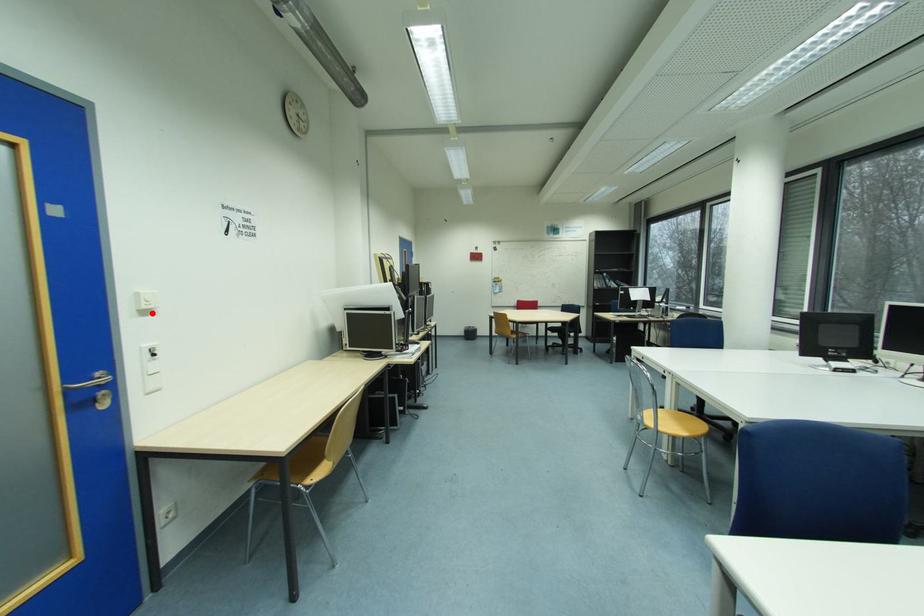
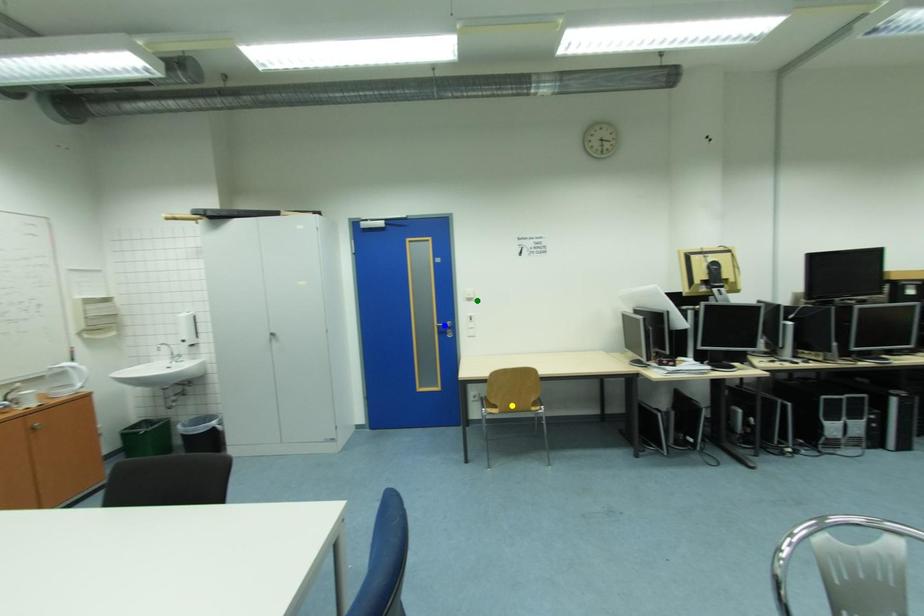
Question: I am providing you with two images of the same scene from different viewpoints. A red point is marked on the first image. You are given multiple points on the second image. Which mark in image 2 goes with the point in image 1?

Choices:
 (A) yellow point
 (B) blue point
 (C) green point

Answer: (C)